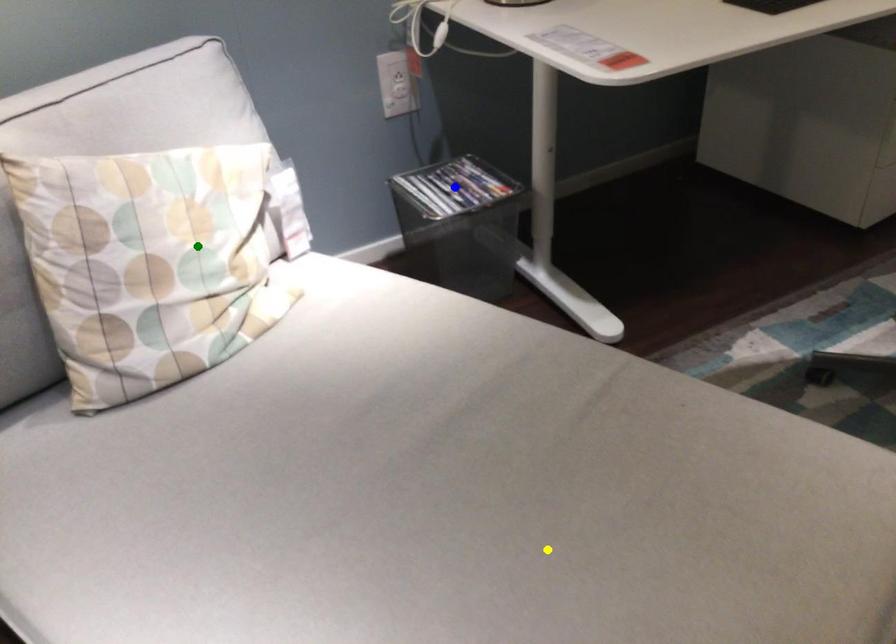
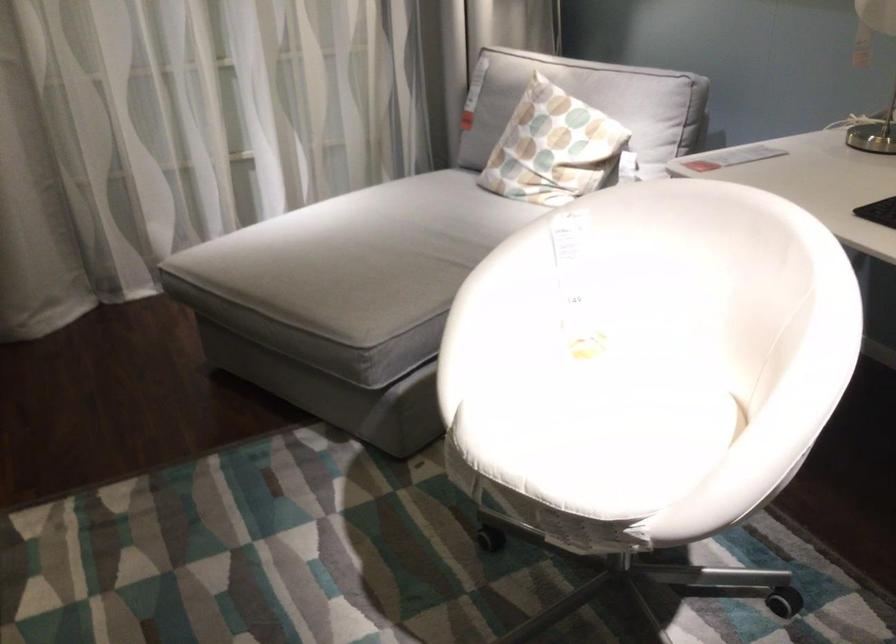
I am providing you with two images of the same scene from different viewpoints. Three points are marked in image1. Which point corresponds to a part or object that is occluded in image2?In image1, three points are marked. Which of them correspond to a part or object that is occluded in image2?Among the three points shown in image1, which one corresponds to a part or object that is no longer visible due to occlusion in image2?

blue point